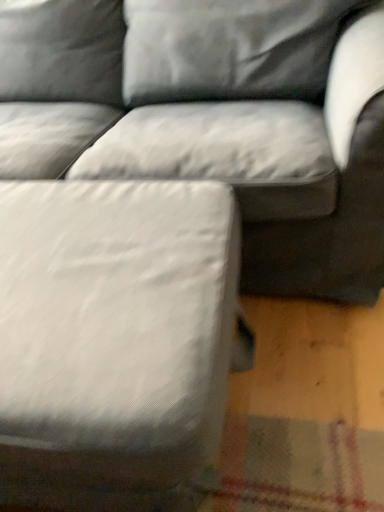
Find the location of a particular element. This screenshot has width=384, height=512. white fabric ottoman at lower left is located at coordinates (115, 341).

Describe the element at coordinates (115, 341) in the screenshot. I see `white fabric ottoman at lower left` at that location.

The width and height of the screenshot is (384, 512). I want to click on white fabric ottoman at lower left, so click(x=115, y=341).